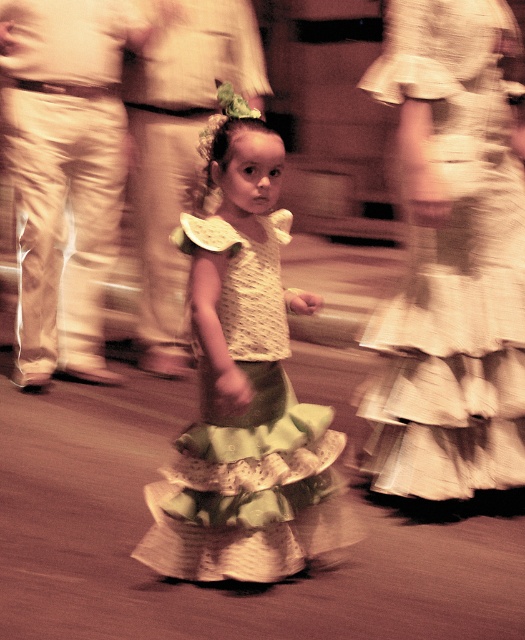
From the picture: Can you confirm if green ruffled skirt at center is positioned below green textured skirt at center?

Incorrect, green ruffled skirt at center is not positioned below green textured skirt at center.

Who is positioned more to the right, green ruffled skirt at center or green textured skirt at center?

From the viewer's perspective, green ruffled skirt at center appears more on the right side.

Is point (408, 179) closer to viewer compared to point (224, 554)?

No, it is behind (224, 554).

Locate an element on the screen. The width and height of the screenshot is (525, 640). green ruffled skirt at center is located at coordinates (450, 257).